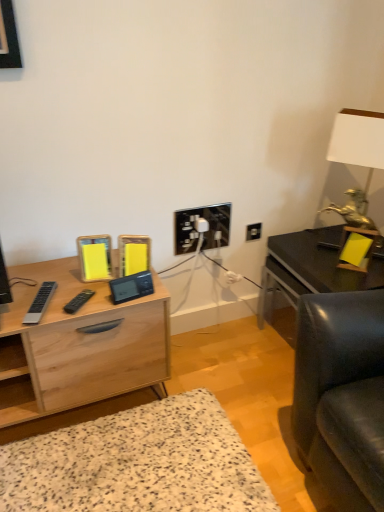
The image size is (384, 512). What are the coordinates of `vacant area located to the right-hand side of light wood desk at center` in the screenshot? It's located at (231, 374).